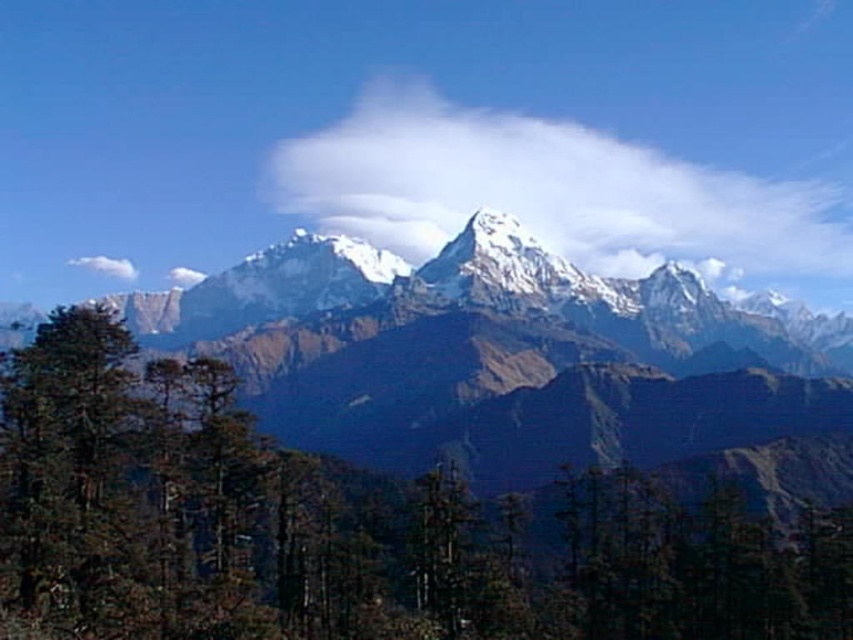
You are an airplane pilot flying through the sky and see the white fluffy cloud at center and the white fluffy cloud at upper center. Which cloud would you need to maneuver around if you want to avoid the wider one?

The white fluffy cloud at center is wider than the white fluffy cloud at upper center, so you should maneuver around the white fluffy cloud at center to avoid the wider one.

You are an airplane pilot flying at a lower altitude and spot two white fluffy clouds in the sky. You need to navigate between them. Which cloud, the white fluffy cloud at center or the white fluffy cloud at upper center, is taller and requires more clearance?

The white fluffy cloud at center is much taller than the white fluffy cloud at upper center, so it requires more clearance.